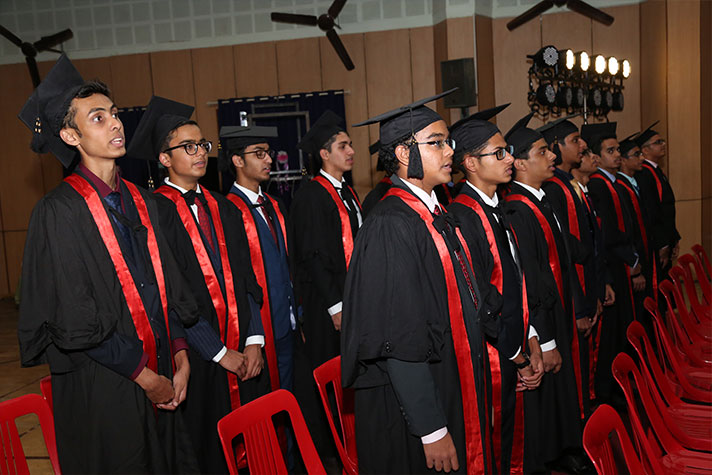
Find the location of a particular element. chairs is located at coordinates (661, 428), (676, 357), (686, 315), (276, 439), (325, 395), (31, 412).